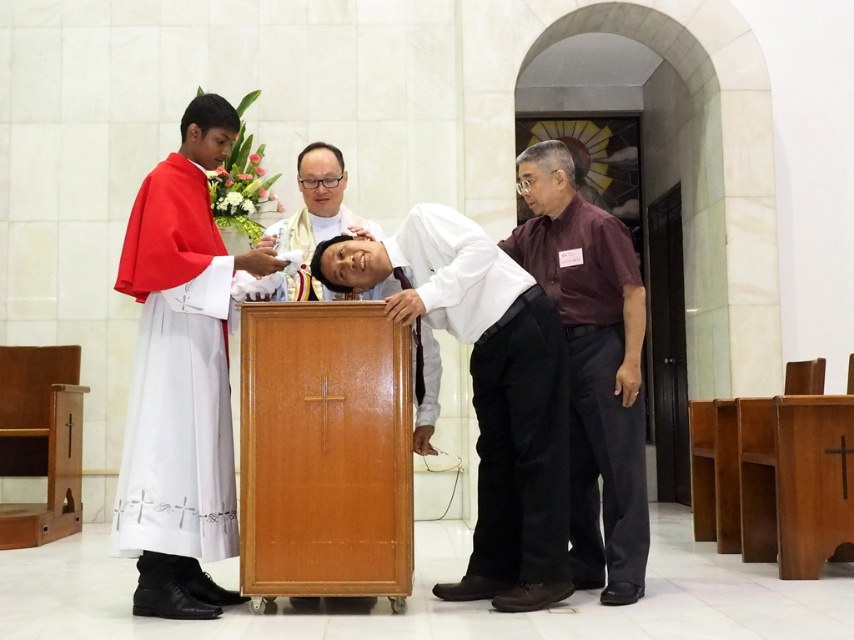
Between point (478, 225) and point (355, 225), which one is positioned in front?

Positioned in front is point (355, 225).

Which of these two, white matte/soft robe at center or white glossy wood lectern at center, stands taller?

white matte/soft robe at center is taller.

Locate an element on the screen. white matte/soft robe at center is located at coordinates (496, 387).

Measure the distance from matte red fabric at left to white glossy wood lectern at center.

matte red fabric at left is 35.60 inches from white glossy wood lectern at center.

This screenshot has width=854, height=640. What do you see at coordinates (176, 374) in the screenshot?
I see `matte red fabric at left` at bounding box center [176, 374].

In order to click on matte red fabric at left in this screenshot , I will do `click(176, 374)`.

The height and width of the screenshot is (640, 854). Describe the element at coordinates (176, 374) in the screenshot. I see `matte red fabric at left` at that location.

Based on the photo, does matte red fabric at left appear over white matte/soft robe at center?

Yes.

Locate an element on the screen. The height and width of the screenshot is (640, 854). matte red fabric at left is located at coordinates (176, 374).